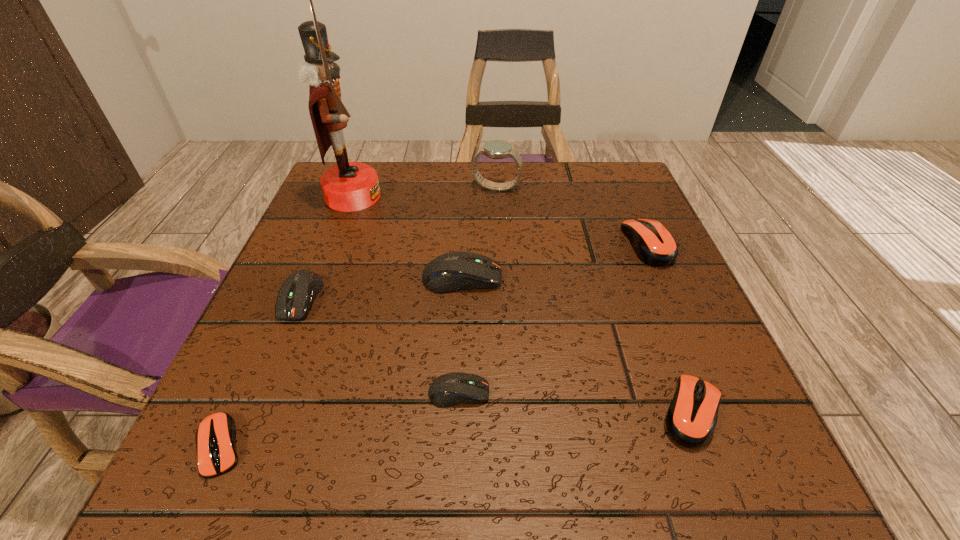
Identify the location of the shortest computer mouse. (215, 437).

Find the location of a particular element. The image size is (960, 540). the leftmost orange computer mouse is located at coordinates click(x=215, y=437).

Image resolution: width=960 pixels, height=540 pixels. I want to click on free location located on the front-facing side of the tallest object, so click(499, 197).

Where is `vacant area located on the right of the seventh shortest object`? Image resolution: width=960 pixels, height=540 pixels. vacant area located on the right of the seventh shortest object is located at coordinates (600, 187).

At what (x,y) coordinates should I click in order to perform the action: click on vacant point located 0.070m on the button of the third tallest object. Please return your answer as a coordinate pair (x, y). This screenshot has height=540, width=960. Looking at the image, I should click on (539, 278).

I want to click on vacant space situated on the back of the biggest orange computer mouse, so click(614, 170).

This screenshot has width=960, height=540. Find the location of `vacant area situated on the button of the leftmost dark computer equipment`. vacant area situated on the button of the leftmost dark computer equipment is located at coordinates (229, 471).

This screenshot has height=540, width=960. Identify the location of vacant region located 0.160m on the left of the second biggest orange computer mouse. (546, 411).

Locate an element on the screen. The width and height of the screenshot is (960, 540). vacant space located on the button of the smallest dark computer equipment is located at coordinates (605, 393).

Locate an element on the screen. The width and height of the screenshot is (960, 540). vacant point located 0.050m on the right of the shortest object is located at coordinates (282, 446).